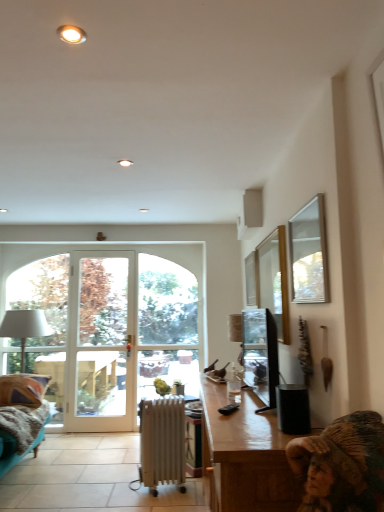
Question: Can you confirm if white metallic radiator at center is thinner than satin black television at right?

Choices:
 (A) yes
 (B) no

Answer: (B)

Question: Does white metallic radiator at center turn towards satin black television at right?

Choices:
 (A) yes
 (B) no

Answer: (B)

Question: Considering the relative positions of white metallic radiator at center and satin black television at right in the image provided, is white metallic radiator at center to the right of satin black television at right from the viewer's perspective?

Choices:
 (A) yes
 (B) no

Answer: (B)

Question: Does white metallic radiator at center have a greater width compared to satin black television at right?

Choices:
 (A) no
 (B) yes

Answer: (B)

Question: Is white metallic radiator at center positioned with its back to satin black television at right?

Choices:
 (A) no
 (B) yes

Answer: (A)

Question: Is white metallic radiator at center positioned far away from satin black television at right?

Choices:
 (A) no
 (B) yes

Answer: (B)

Question: Is satin black television at right wider than white glass window at center, which is the first window in left-to-right order?

Choices:
 (A) yes
 (B) no

Answer: (A)

Question: Considering the relative positions of satin black television at right and white glass window at center, arranged as the 3th window when viewed from the front, in the image provided, is satin black television at right to the right of white glass window at center, arranged as the 3th window when viewed from the front, from the viewer's perspective?

Choices:
 (A) no
 (B) yes

Answer: (B)

Question: Is white glass window at center, arranged as the 3th window when viewed from the front, surrounded by satin black television at right?

Choices:
 (A) no
 (B) yes

Answer: (A)

Question: From a real-world perspective, is satin black television at right located beneath white glass window at center, positioned as the first window in back-to-front order?

Choices:
 (A) yes
 (B) no

Answer: (B)

Question: From the image's perspective, is satin black television at right on top of white glass window at center, which is the first window in left-to-right order?

Choices:
 (A) yes
 (B) no

Answer: (A)

Question: Considering the relative positions of satin black television at right and white glass window at center, positioned as the first window in back-to-front order, in the image provided, is satin black television at right to the left of white glass window at center, positioned as the first window in back-to-front order, from the viewer's perspective?

Choices:
 (A) yes
 (B) no

Answer: (B)

Question: Is wooden desk at lower right with satin black television at right?

Choices:
 (A) no
 (B) yes

Answer: (A)